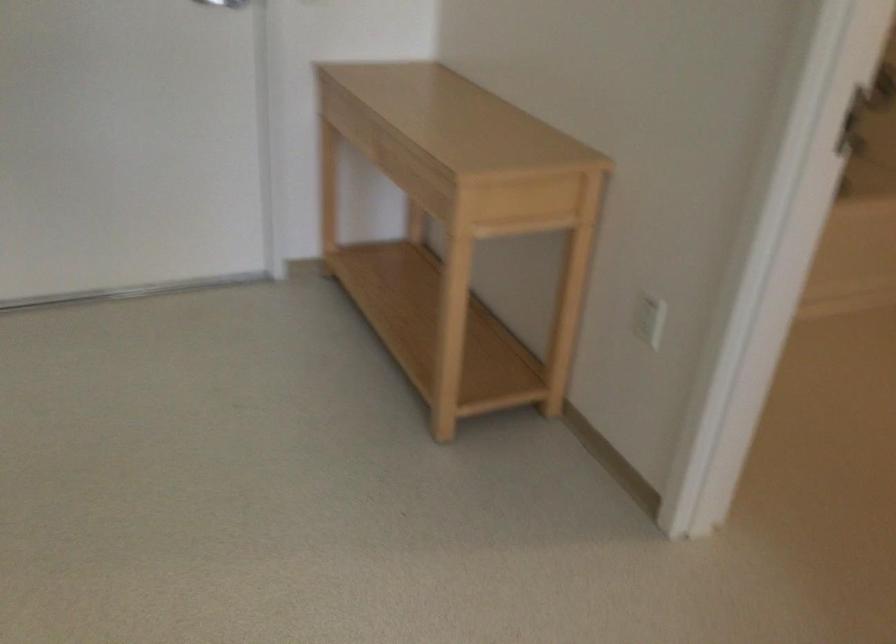
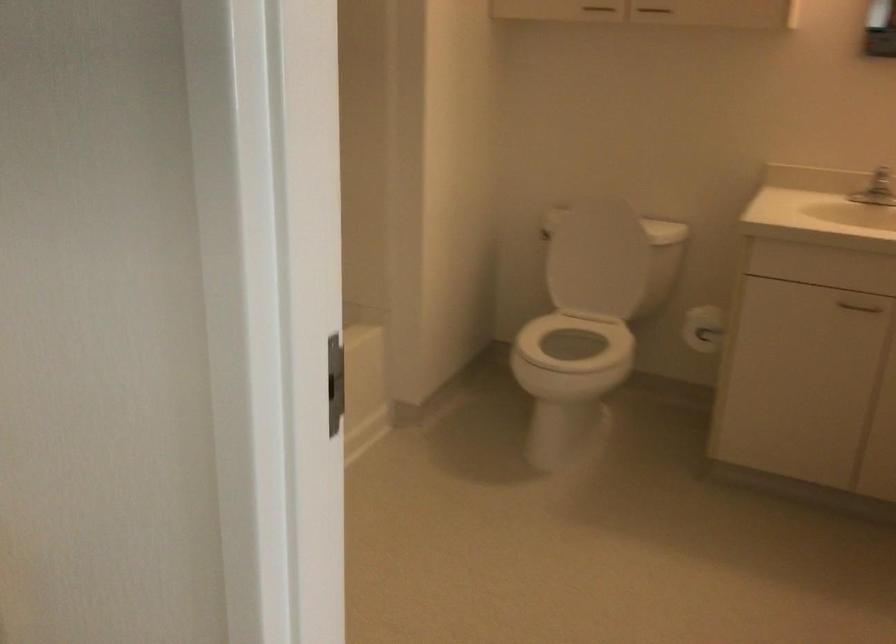
Question: The camera is either moving clockwise (left) or counter-clockwise (right) around the object. The first image is from the beginning of the video and the second image is from the end. Is the camera moving left or right when shooting the video?

Choices:
 (A) Left
 (B) Right

Answer: (A)